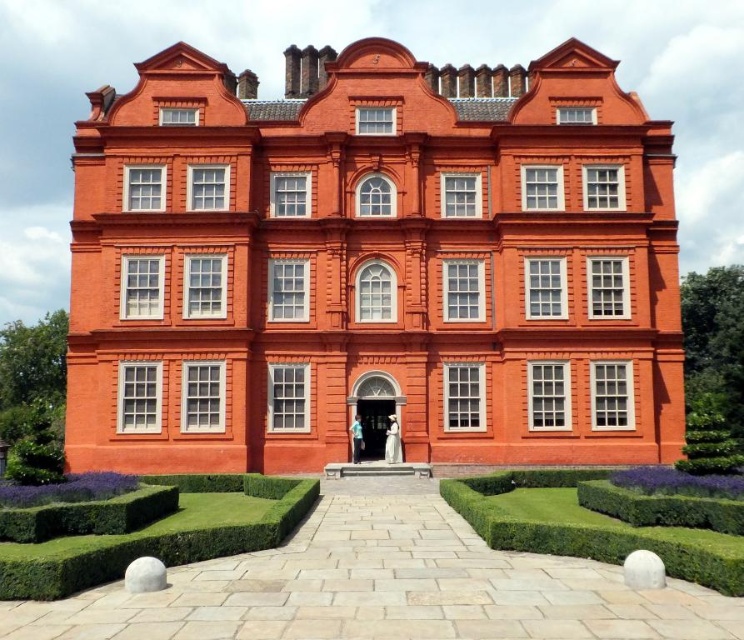
Question: Does green hedge at center lie behind green textured hedge at lower left?

Choices:
 (A) yes
 (B) no

Answer: (B)

Question: Which point is farther to the camera?

Choices:
 (A) (70, 504)
 (B) (577, 484)
 (C) (565, 499)
 (D) (211, 518)

Answer: (B)

Question: Can you confirm if green textured hedge at center is positioned to the right of green leafy hedge at lower right?

Choices:
 (A) yes
 (B) no

Answer: (B)

Question: Among these objects, which one is farthest from the camera?

Choices:
 (A) green hedge at lower center
 (B) green textured hedge at lower left

Answer: (B)

Question: Which of the following is the closest to the observer?

Choices:
 (A) (500, 499)
 (B) (626, 496)
 (C) (222, 545)

Answer: (C)

Question: Observing the image, what is the correct spatial positioning of green hedge at center in reference to green textured hedge at center?

Choices:
 (A) left
 (B) right

Answer: (A)